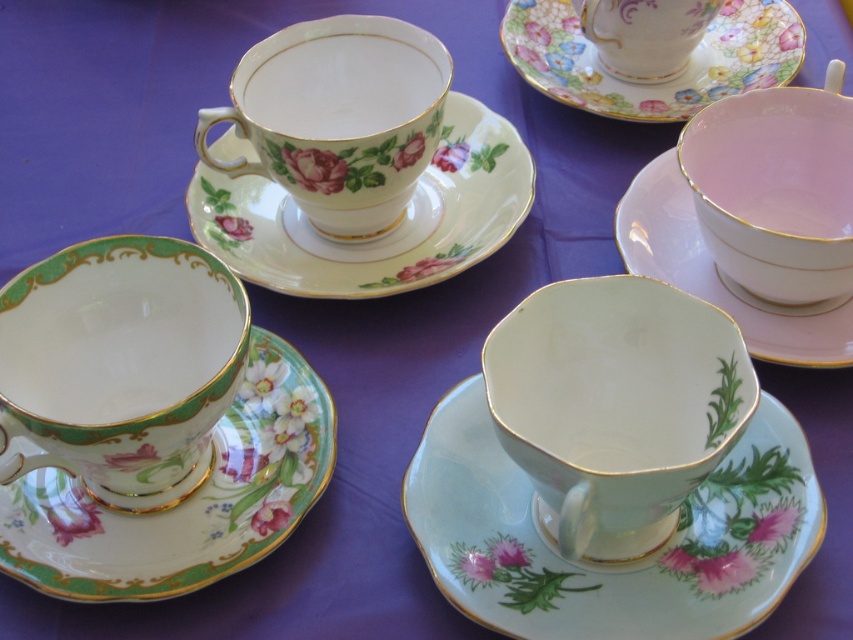
You are standing in front of a dining table with several items placed on it. There is a pink glossy bowl at upper right. Can you tell me what is located at the coordinates point (775, 189)?

The coordinates point (775, 189) correspond to the pink glossy bowl at upper right.

You are a server in a tea shop and need to place a new teapot between the pink glossy bowl at upper right and the porcelain floral teacup at upper right. The teapot is 12 inches wide. Can you fit it between them without moving the existing items?

The pink glossy bowl at upper right is 12.01 inches away from the porcelain floral teacup at upper right. Since the distance is slightly more than the teapot width of 12 inches, the teapot can fit between them without moving the existing items.